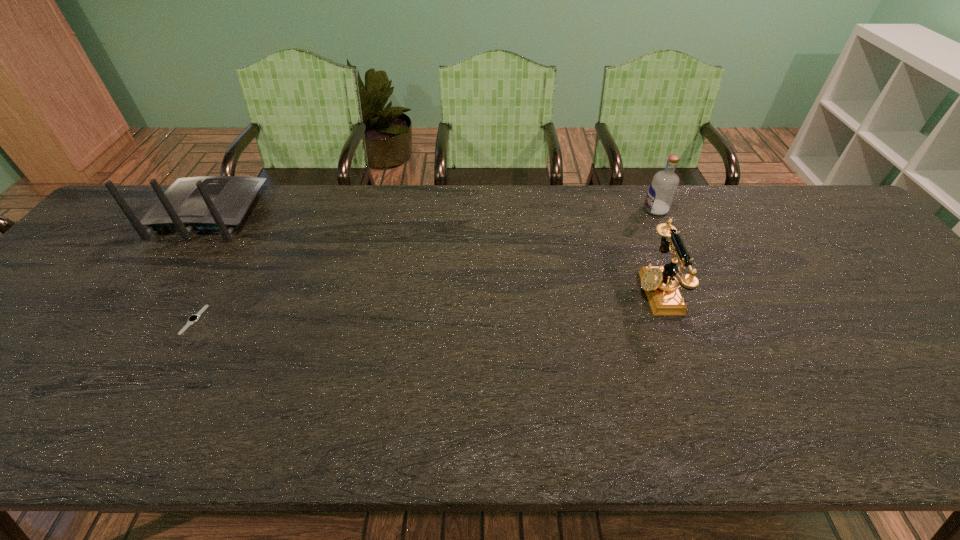
I want to click on free region located 0.060m on the back of the watch, so click(213, 287).

Where is `router located at the far edge`? This screenshot has width=960, height=540. router located at the far edge is located at coordinates (207, 203).

The width and height of the screenshot is (960, 540). I want to click on vodka that is positioned at the far edge, so click(663, 187).

Identify the location of object at the left edge. The width and height of the screenshot is (960, 540). (207, 203).

Identify the location of object that is at the far left corner. Image resolution: width=960 pixels, height=540 pixels. [x=207, y=203].

At what (x,y) coordinates should I click in order to perform the action: click on vacant area at the far edge. Please return your answer as a coordinate pair (x, y). The height and width of the screenshot is (540, 960). Looking at the image, I should click on (571, 191).

Where is `vacant point at the near edge`? vacant point at the near edge is located at coordinates (373, 416).

Locate an element on the screen. This screenshot has height=540, width=960. vacant region at the left edge of the desktop is located at coordinates pyautogui.click(x=80, y=289).

Where is `free spot at the far left corner of the desktop`? The image size is (960, 540). free spot at the far left corner of the desktop is located at coordinates (143, 215).

The height and width of the screenshot is (540, 960). Identify the location of vacant area at the far right corner of the desktop. (804, 201).